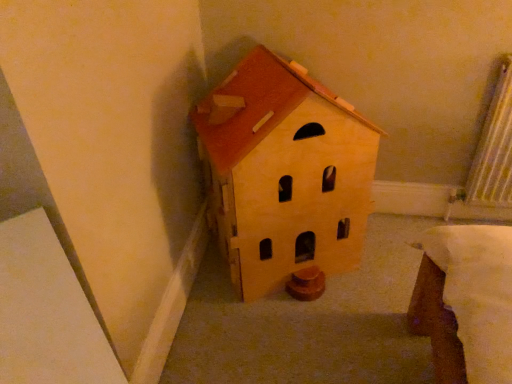
Describe the element at coordinates (285, 173) in the screenshot. I see `wooden house at center` at that location.

Where is `wooden house at center`? The width and height of the screenshot is (512, 384). wooden house at center is located at coordinates (285, 173).

What is the approximate height of wooden house at center?

The height of wooden house at center is 32.04 inches.

In order to click on wooden house at center in this screenshot , I will do `click(285, 173)`.